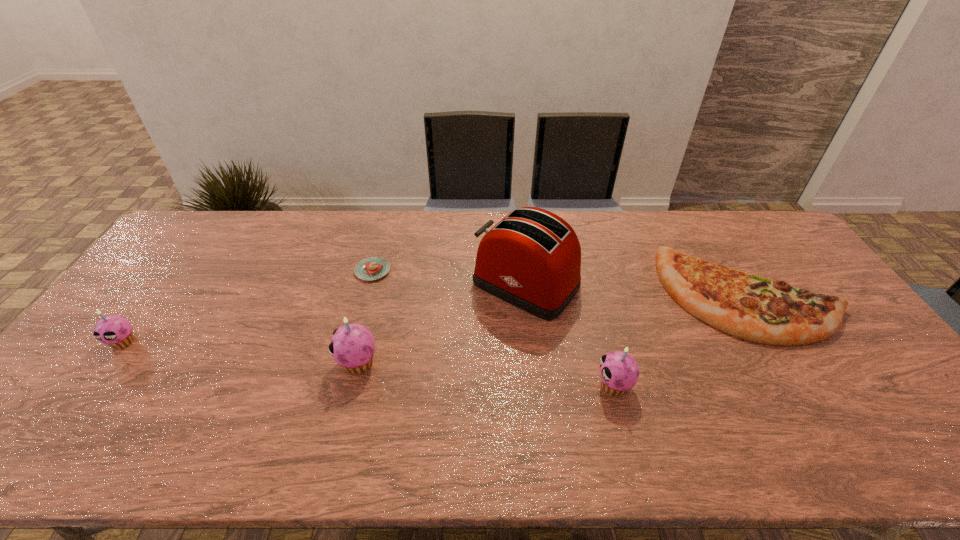
The cupcakes are evenly distributed in the image. To maintain this, where would you place another cupcake on the right? Please point to a free space. Please provide its 2D coordinates. Your answer should be formatted as a tuple, i.e. [(x, y)], where the tuple contains the x and y coordinates of a point satisfying the conditions above.

[(894, 409)]